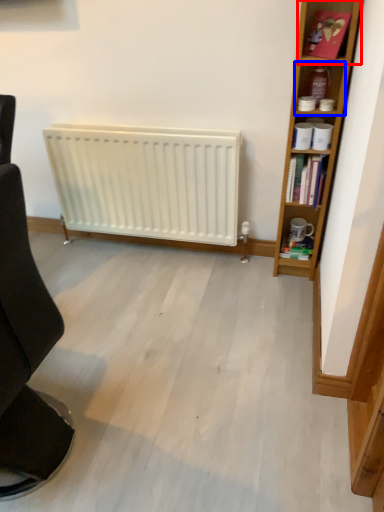
Question: Which object is closer to the camera taking this photo, cabinet (highlighted by a red box) or shelf (highlighted by a blue box)?

Choices:
 (A) cabinet
 (B) shelf

Answer: (A)